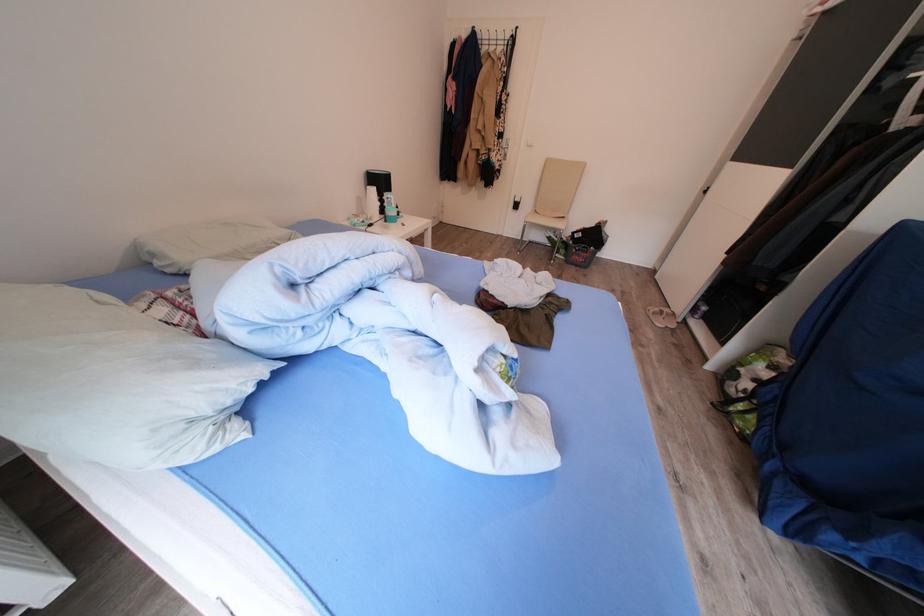
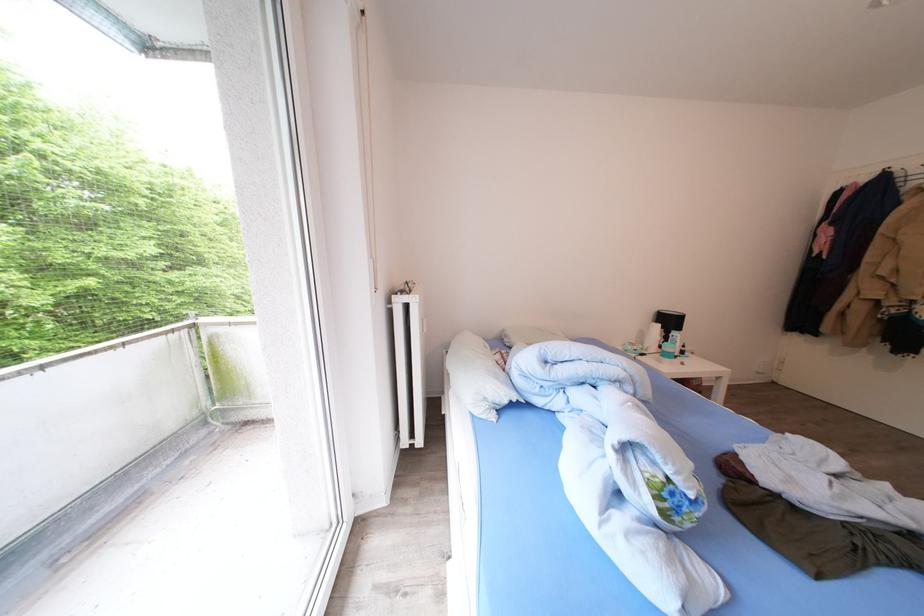
In the second image, find the point that corresponds to [204,369] in the first image.

(505, 383)